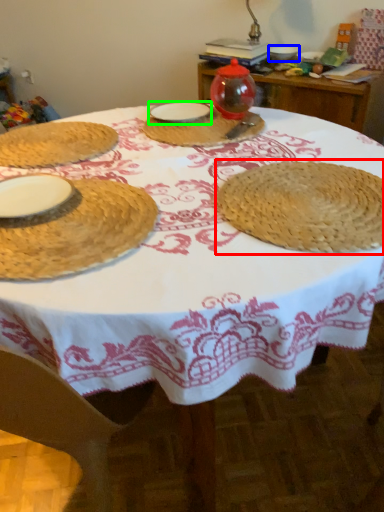
Question: Which is farther away from straw hat (highlighted by a red box)? tableware (highlighted by a blue box) or tableware (highlighted by a green box)?

Choices:
 (A) tableware
 (B) tableware

Answer: (A)